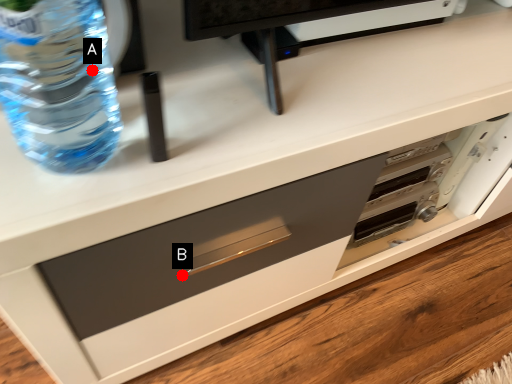
Question: Two points are circled on the image, labeled by A and B beside each circle. Which point is closer to the camera?

Choices:
 (A) A is closer
 (B) B is closer

Answer: (A)